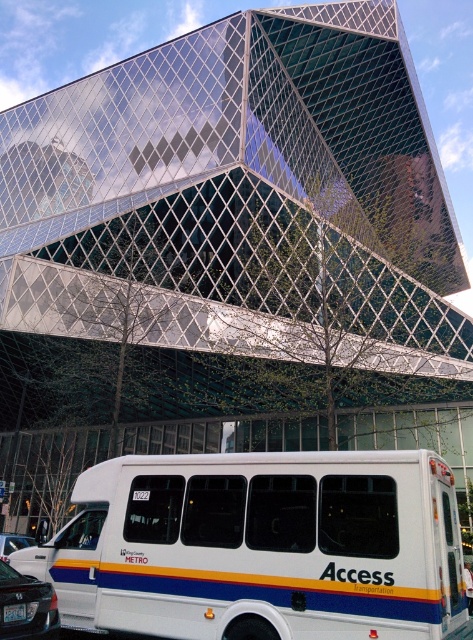
You are standing in front of the modern building and want to locate two specific points marked on the ground. The first point is at coordinate point [20,637] and the second is at point [5,557]. Which of these two points is closer to you?

Point [20,637] is closer to the viewer than point [5,557].

You are a delivery driver who needs to park your truck between the metallic silver sedan at lower left and the metallic silver car at lower left. Is there enough space between them to park your truck, which is 25 feet long?

The metallic silver sedan at lower left and metallic silver car at lower left are 28.79 feet apart. Since your truck is 25 feet long, there is enough space to park between them.

You are a delivery person who needs to load a tall package into your vehicle. You have a choice between the white metallic van at center and the metallic silver sedan at lower left. Based on the scene, which vehicle would be more suitable for carrying the tall package?

The white metallic van at center has a greater height compared to the metallic silver sedan at lower left, so it would be more suitable for carrying the tall package.